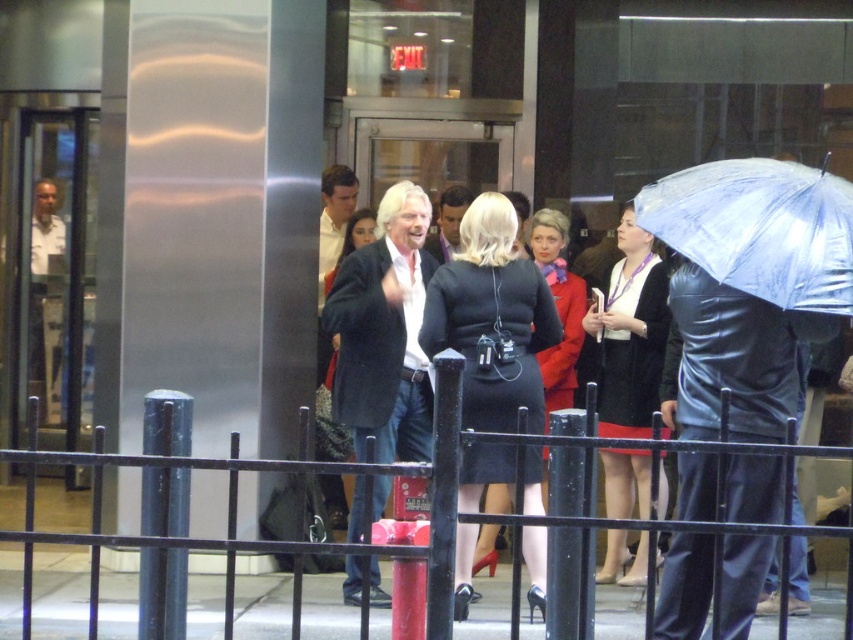
Question: Which point is closer to the camera taking this photo?

Choices:
 (A) (637, 420)
 (B) (805, 266)
 (C) (427, 312)

Answer: (B)

Question: Which point is farther to the camera?

Choices:
 (A) (231, 490)
 (B) (462, 577)

Answer: (B)

Question: Is transparent plastic umbrella at right to the left of velvet black coat at center from the viewer's perspective?

Choices:
 (A) no
 (B) yes

Answer: (A)

Question: Does black fabric dress at center have a greater width compared to black metal fence at lower center?

Choices:
 (A) yes
 (B) no

Answer: (B)

Question: Which point is farther from the camera taking this photo?

Choices:
 (A) (225, 589)
 (B) (642, 273)

Answer: (B)

Question: Considering the relative positions of transparent plastic umbrella at right and black metal fence at lower center in the image provided, where is transparent plastic umbrella at right located with respect to black metal fence at lower center?

Choices:
 (A) above
 (B) below

Answer: (A)